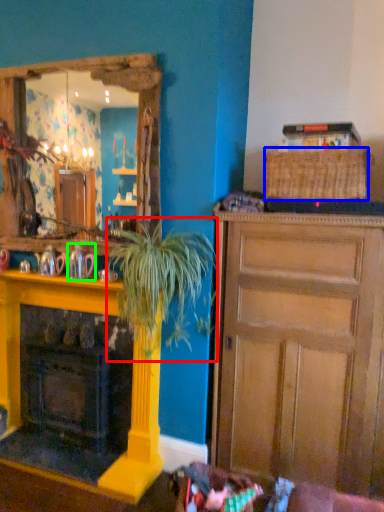
Question: Estimate the real-world distances between objects in this image. Which object is farther from houseplant (highlighted by a red box), picnic basket (highlighted by a blue box) or teapot (highlighted by a green box)?

Choices:
 (A) picnic basket
 (B) teapot

Answer: (A)